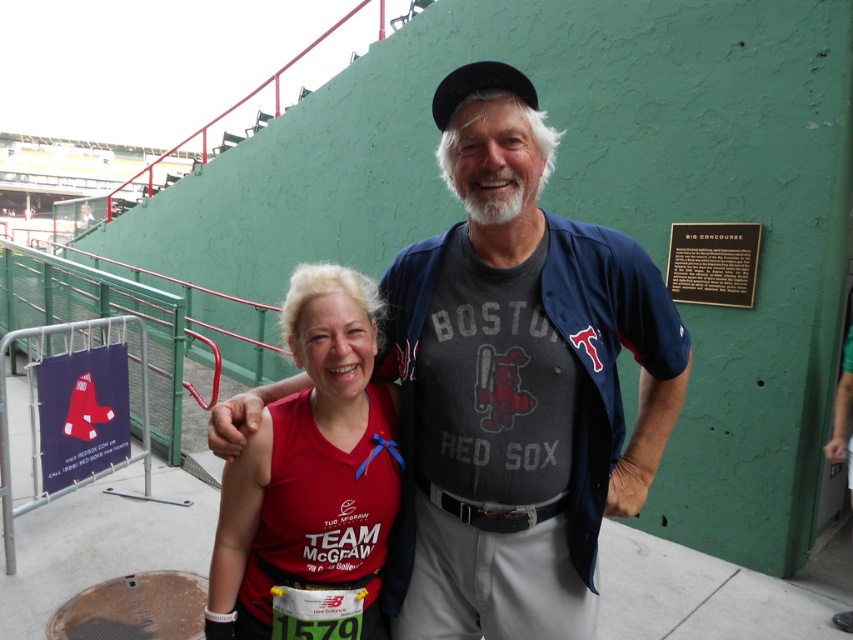
Question: Does dark blue jersey at center have a larger size compared to matte red shirt at center?

Choices:
 (A) yes
 (B) no

Answer: (A)

Question: Among these objects, which one is nearest to the camera?

Choices:
 (A) dark blue jersey at center
 (B) matte red shirt at center

Answer: (A)

Question: Does dark blue jersey at center appear under matte red shirt at center?

Choices:
 (A) no
 (B) yes

Answer: (A)

Question: Which point is farther from the camera taking this photo?

Choices:
 (A) (386, 468)
 (B) (521, 458)

Answer: (A)

Question: Is dark blue jersey at center behind matte red shirt at center?

Choices:
 (A) yes
 (B) no

Answer: (B)